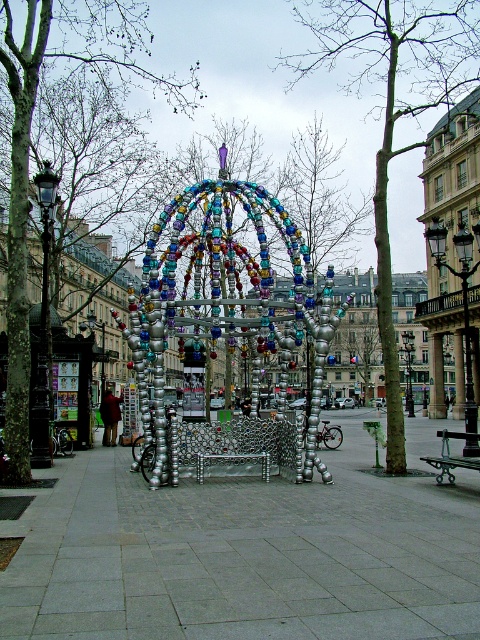
You are a city planner assessing the plaza layout. The metallic beaded structure at center and the smooth bark tree at center are both central elements. Which one is shorter?

The metallic beaded structure at center has a lesser height compared to the smooth bark tree at center, so the metallic beaded structure at center is shorter.

You are a visitor standing in the plaza and want to sit down on the silver metallic bench at center. Which direction should you walk relative to the metallic beaded structure at center to reach it?

The silver metallic bench at center is located below the metallic beaded structure at center, so you should walk downward towards the bench from the structure.

You are standing in the plaza and want to take a photo of the silver metallic sculpture at center without the silver metallic bench at center blocking the view. Where should you position yourself relative to the sculpture to ensure the bench is out of frame?

To avoid the silver metallic bench at center blocking the view, position yourself behind the silver metallic sculpture at center. Since the bench is in front of the sculpture, moving behind it will place the bench between you and the sculpture, thus keeping it out of the frame.